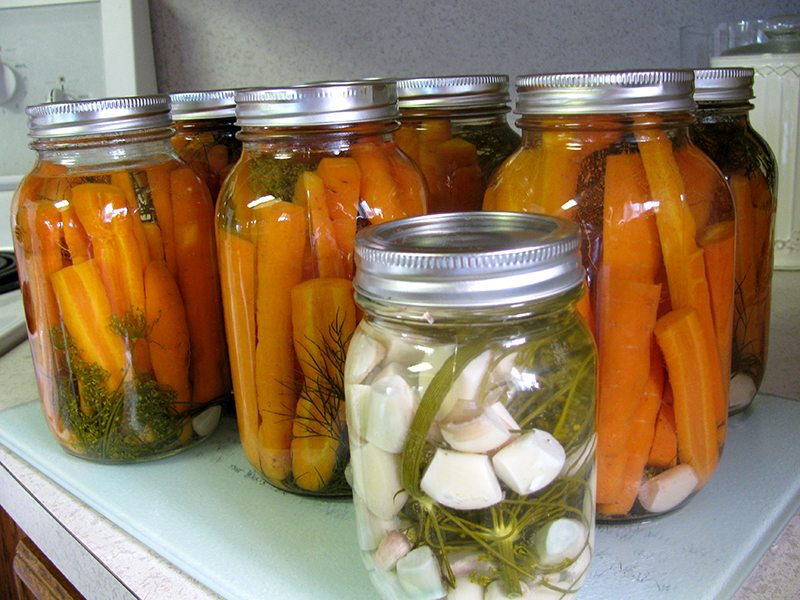
Where is `oven`? This screenshot has width=800, height=600. oven is located at coordinates (20, 78).